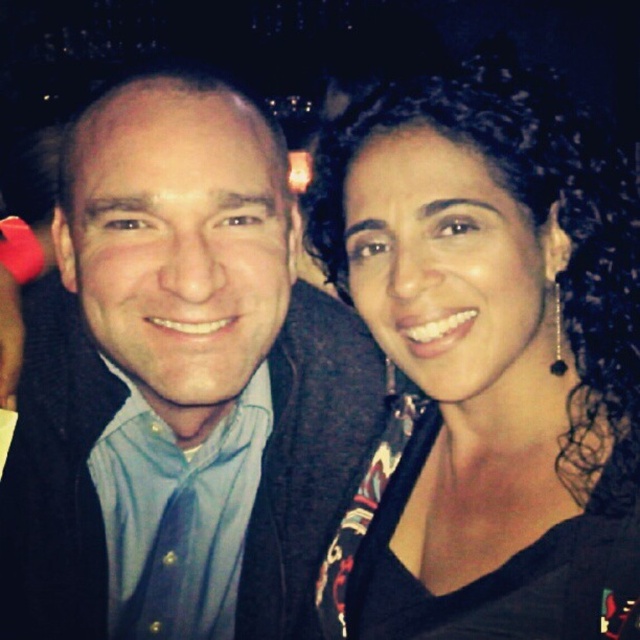
Does blue shirt at center appear over black fabric at center?

No, blue shirt at center is not above black fabric at center.

Which is behind, point (371, 353) or point (508, 500)?

The point (371, 353) is behind.

At what (x,y) coordinates should I click in order to perform the action: click on blue shirt at center. Please return your answer as a coordinate pair (x, y). Looking at the image, I should click on (177, 385).